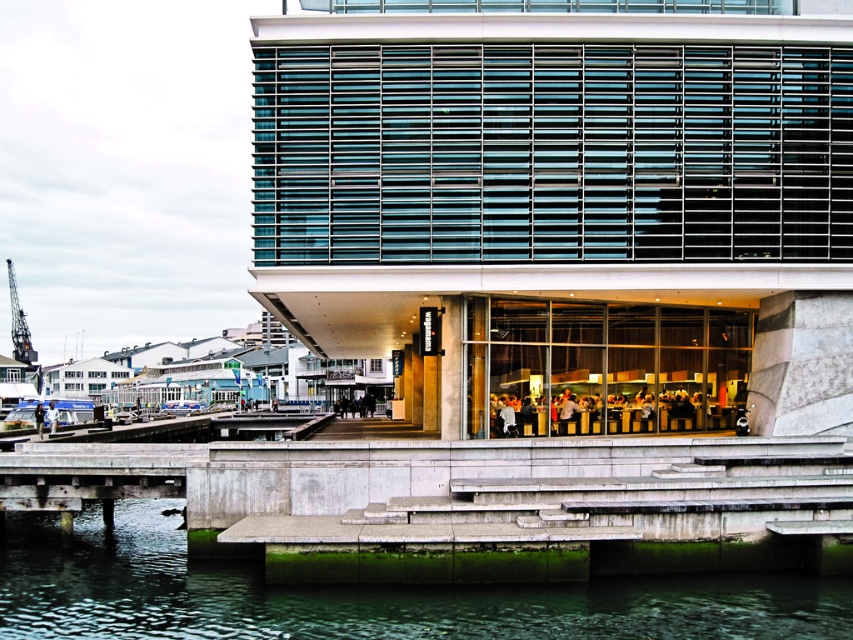
Is matte black sign at center to the right of white fabric person at lower left from the viewer's perspective?

Yes, matte black sign at center is to the right of white fabric person at lower left.

Which is more to the left, matte black sign at center or white fabric person at lower left?

From the viewer's perspective, white fabric person at lower left appears more on the left side.

Identify the location of matte black sign at center. The height and width of the screenshot is (640, 853). (451, 369).

Who is positioned more to the left, green algae-covered concrete at lower center or matte black sign at center?

Positioned to the left is green algae-covered concrete at lower center.

Does point (12, 573) come farther from viewer compared to point (462, 310)?

No, it is not.

This screenshot has width=853, height=640. What do you see at coordinates (363, 595) in the screenshot?
I see `green algae-covered concrete at lower center` at bounding box center [363, 595].

I want to click on green algae-covered concrete at lower center, so click(x=363, y=595).

Is matte black sign at center behind metallic gray crane at left?

That is False.

Is matte black sign at center to the right of metallic gray crane at left from the viewer's perspective?

Yes, matte black sign at center is to the right of metallic gray crane at left.

Which is behind, point (456, 346) or point (10, 285)?

Point (10, 285)

Where is `matte black sign at center`? This screenshot has width=853, height=640. matte black sign at center is located at coordinates (451, 369).